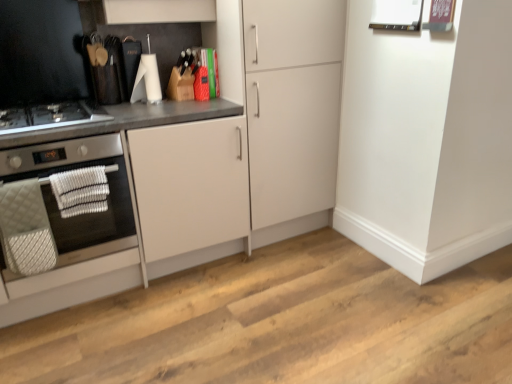
Describe the element at coordinates (292, 105) in the screenshot. I see `white matte cabinet at center, the second cabinetry positioned from the left` at that location.

The width and height of the screenshot is (512, 384). I want to click on silver metallic oven at left, so click(84, 214).

This screenshot has height=384, width=512. I want to click on white matte cabinet at center, the second cabinetry positioned from the left, so click(x=292, y=105).

Is silver metallic oven at left aimed at black glass gas stove at left?

No, silver metallic oven at left is not aimed at black glass gas stove at left.

Considering the points (24, 172) and (104, 111), which point is behind, point (24, 172) or point (104, 111)?

The point (104, 111) is behind.

How many degrees apart are the facing directions of silver metallic oven at left and black glass gas stove at left?

They differ by 1.5e-05 degrees in their facing directions.

From a real-world perspective, between silver metallic oven at left and black glass gas stove at left, who is vertically lower?

silver metallic oven at left.

From a real-world perspective, is silver metallic oven at left below white matte cabinet at center, the second cabinetry positioned from the left?

Indeed, from a real-world perspective, silver metallic oven at left is positioned beneath white matte cabinet at center, the second cabinetry positioned from the left.

From the image's perspective, who appears lower, silver metallic oven at left or white matte cabinet at center, the second cabinetry positioned from the left?

silver metallic oven at left appears lower in the image.

Is silver metallic oven at left positioned with its back to white matte cabinet at center, the second cabinetry positioned from the left?

No.

Is white matte cabinet at center, the second cabinetry positioned from the left, smaller than white matte cabinet at left, positioned as the first cabinetry in left-to-right order?

Yes, white matte cabinet at center, the second cabinetry positioned from the left, is smaller than white matte cabinet at left, positioned as the first cabinetry in left-to-right order.

What are the coordinates of `cabinetry lying in front of the white matte cabinet at center, which is the first cabinetry from right to left` in the screenshot? It's located at (249, 138).

Considering the relative positions of white matte cabinet at center, which is the first cabinetry from right to left, and white matte cabinet at left, positioned as the first cabinetry in left-to-right order, in the image provided, is white matte cabinet at center, which is the first cabinetry from right to left, to the left of white matte cabinet at left, positioned as the first cabinetry in left-to-right order, from the viewer's perspective?

Incorrect, white matte cabinet at center, which is the first cabinetry from right to left, is not on the left side of white matte cabinet at left, positioned as the first cabinetry in left-to-right order.

Can you tell me how much white matte cabinet at center, which is the first cabinetry from right to left, and white matte cabinet at left, positioned as the first cabinetry in left-to-right order, differ in facing direction?

The facing directions of white matte cabinet at center, which is the first cabinetry from right to left, and white matte cabinet at left, positioned as the first cabinetry in left-to-right order, are 2.32 degrees apart.

From a real-world perspective, which object stands above the other?

From a 3D spatial view, white matte cabinet at center, which is the first cabinetry from right to left, is above.

Between white matte cabinet at left, the 2th cabinetry when ordered from right to left, and white matte cabinet at center, which is the first cabinetry from right to left, which one has more height?

With more height is white matte cabinet at center, which is the first cabinetry from right to left.

Considering the relative positions of white matte cabinet at left, the 2th cabinetry when ordered from right to left, and white matte cabinet at center, which is the first cabinetry from right to left, in the image provided, is white matte cabinet at left, the 2th cabinetry when ordered from right to left, to the left or to the right of white matte cabinet at center, which is the first cabinetry from right to left,?

white matte cabinet at left, the 2th cabinetry when ordered from right to left, is positioned on white matte cabinet at center, which is the first cabinetry from right to left,'s left side.

What's the angular difference between white matte cabinet at left, positioned as the first cabinetry in left-to-right order, and white matte cabinet at center, the second cabinetry positioned from the left,'s facing directions?

There is a 2.32-degree angle between the facing directions of white matte cabinet at left, positioned as the first cabinetry in left-to-right order, and white matte cabinet at center, the second cabinetry positioned from the left.

From the image's perspective, does white matte cabinet at center, which is the first cabinetry from right to left, appear lower than silver metallic oven at left?

No.

Which object is further away from the camera, black glass gas stove at left or white matte cabinet at left, positioned as the first cabinetry in left-to-right order?

black glass gas stove at left is further away from the camera.

In the scene shown: Could you tell me if black glass gas stove at left is facing white matte cabinet at left, the 2th cabinetry when ordered from right to left?

No.

From the image's perspective, is black glass gas stove at left over white matte cabinet at left, the 2th cabinetry when ordered from right to left?

Correct, black glass gas stove at left appears higher than white matte cabinet at left, the 2th cabinetry when ordered from right to left, in the image.

How different are the orientations of black glass gas stove at left and white matte cabinet at left, positioned as the first cabinetry in left-to-right order, in degrees?

The angular difference between black glass gas stove at left and white matte cabinet at left, positioned as the first cabinetry in left-to-right order, is 6.72e-06 degrees.

Is white matte cabinet at center, the second cabinetry positioned from the left, oriented away from black glass gas stove at left?

white matte cabinet at center, the second cabinetry positioned from the left, does not have its back to black glass gas stove at left.

Based on the photo, in terms of height, does white matte cabinet at center, the second cabinetry positioned from the left, look taller or shorter compared to black glass gas stove at left?

white matte cabinet at center, the second cabinetry positioned from the left, is taller than black glass gas stove at left.

Considering the points (298, 185) and (6, 125), which point is in front, point (298, 185) or point (6, 125)?

The point (6, 125) is closer.

This screenshot has width=512, height=384. In order to click on gas stove behind the silver metallic oven at left in this screenshot , I will do `click(50, 116)`.

In order to click on cabinetry that is above the silver metallic oven at left (from the image's perspective) in this screenshot , I will do `click(292, 105)`.

In the scene shown: When comparing their distances from silver metallic oven at left, does white matte cabinet at left, the 2th cabinetry when ordered from right to left, or white matte cabinet at center, which is the first cabinetry from right to left, seem closer?

white matte cabinet at left, the 2th cabinetry when ordered from right to left.

From the image, which object appears to be farther from black glass gas stove at left, silver metallic oven at left or white matte cabinet at left, positioned as the first cabinetry in left-to-right order?

white matte cabinet at left, positioned as the first cabinetry in left-to-right order, is positioned further to the anchor black glass gas stove at left.

Estimate the real-world distances between objects in this image. Which object is further from silver metallic oven at left, white matte cabinet at center, which is the first cabinetry from right to left, or white matte cabinet at left, the 2th cabinetry when ordered from right to left?

Based on the image, white matte cabinet at center, which is the first cabinetry from right to left, appears to be further to silver metallic oven at left.

From the picture: Estimate the real-world distances between objects in this image. Which object is further from black glass gas stove at left, white matte cabinet at center, which is the first cabinetry from right to left, or silver metallic oven at left?

The object further to black glass gas stove at left is white matte cabinet at center, which is the first cabinetry from right to left.

Which object lies nearer to the anchor point white matte cabinet at center, which is the first cabinetry from right to left, black glass gas stove at left or silver metallic oven at left?

silver metallic oven at left is closer to white matte cabinet at center, which is the first cabinetry from right to left.

When comparing their distances from silver metallic oven at left, does black glass gas stove at left or white matte cabinet at left, positioned as the first cabinetry in left-to-right order, seem closer?

black glass gas stove at left is closer to silver metallic oven at left.

Considering their positions, is silver metallic oven at left positioned further to white matte cabinet at left, positioned as the first cabinetry in left-to-right order, than white matte cabinet at center, which is the first cabinetry from right to left?

Based on the image, silver metallic oven at left appears to be further to white matte cabinet at left, positioned as the first cabinetry in left-to-right order.

Which object lies nearer to the anchor point white matte cabinet at left, the 2th cabinetry when ordered from right to left, white matte cabinet at center, which is the first cabinetry from right to left, or silver metallic oven at left?

white matte cabinet at center, which is the first cabinetry from right to left, is positioned closer to the anchor white matte cabinet at left, the 2th cabinetry when ordered from right to left.

Locate an element on the screen. gas stove between silver metallic oven at left and white matte cabinet at center, the second cabinetry positioned from the left, from left to right is located at coordinates (50, 116).

The height and width of the screenshot is (384, 512). Identify the location of cabinetry located between silver metallic oven at left and white matte cabinet at center, the second cabinetry positioned from the left, in the left-right direction. (249, 138).

Find the location of `home appliance between black glass gas stove at left and white matte cabinet at left, positioned as the first cabinetry in left-to-right order, in the vertical direction`. home appliance between black glass gas stove at left and white matte cabinet at left, positioned as the first cabinetry in left-to-right order, in the vertical direction is located at coordinates (84, 214).

I want to click on cabinetry between black glass gas stove at left and white matte cabinet at center, which is the first cabinetry from right to left, from left to right, so click(249, 138).